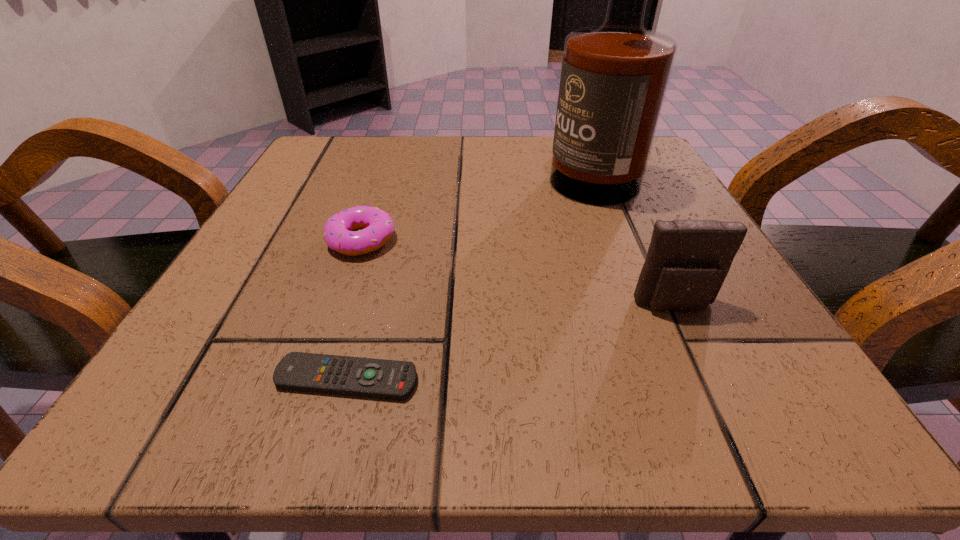
I want to click on vacant space located 0.310m on the front label of the farthest object, so click(x=391, y=167).

Identify the location of free region located with an open flap on the pouch. (700, 361).

Locate an element on the screen. vacant space located 0.300m on the right of the third tallest object is located at coordinates (585, 240).

What are the coordinates of `free space located 0.290m on the right of the nearest object` in the screenshot? It's located at (673, 379).

Locate an element on the screen. This screenshot has width=960, height=540. object that is at the far edge is located at coordinates (614, 77).

Where is `object located at the near edge`? object located at the near edge is located at coordinates (377, 378).

Locate an element on the screen. This screenshot has height=540, width=960. doughnut located in the left edge section of the desktop is located at coordinates (377, 226).

Locate an element on the screen. This screenshot has height=540, width=960. remote control that is at the left edge is located at coordinates (377, 378).

Locate an element on the screen. The image size is (960, 540). liquor located at the right edge is located at coordinates (614, 77).

I want to click on pouch present at the right edge, so click(x=687, y=262).